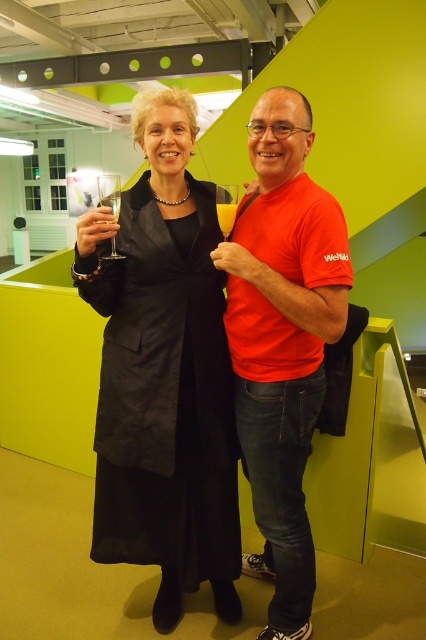
Is matte red t-shirt at center to the left of clear glass at upper left from the viewer's perspective?

In fact, matte red t-shirt at center is to the right of clear glass at upper left.

Where is `matte red t-shirt at center`? The height and width of the screenshot is (640, 426). matte red t-shirt at center is located at coordinates (282, 340).

Can you confirm if black matte coat at center is wider than clear glass at upper left?

No, black matte coat at center is not wider than clear glass at upper left.

This screenshot has height=640, width=426. In order to click on black matte coat at center in this screenshot , I will do `click(164, 372)`.

Find the location of a particular element. black matte coat at center is located at coordinates (164, 372).

Does clear glass at upper left appear under translucent glass at upper center?

Incorrect, clear glass at upper left is not positioned below translucent glass at upper center.

Is point (112, 257) closer to viewer compared to point (216, 216)?

Yes, it is in front of point (216, 216).

Is point (103, 192) positioned behind point (233, 211)?

Yes, point (103, 192) is farther from viewer.

Locate an element on the screen. The height and width of the screenshot is (640, 426). clear glass at upper left is located at coordinates (109, 193).